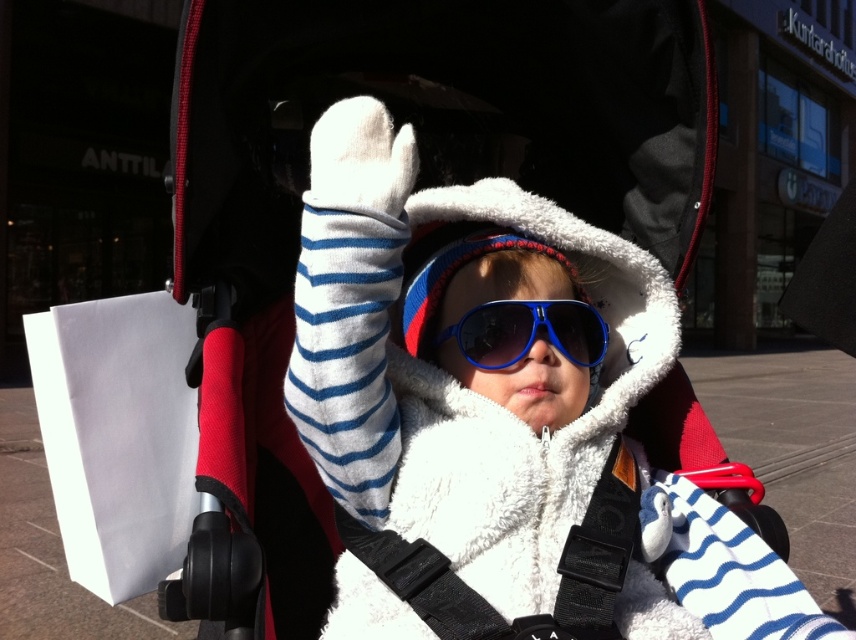
You are a parent trying to secure the white shopping bag to the stroller. The black fabric strap at center and the blue plastic goggles at center are both in your way. Which object should you move first to make more space?

The black fabric strap at center has a larger width than the blue plastic goggles at center, so you should move the black fabric strap at center first to create more space.

You are a parent trying to secure your child in the stroller. You have the black fabric strap at center and blue plastic goggles at center. Which item should you adjust first to ensure the goggles are properly secured?

The black fabric strap at center is positioned on the left side of blue plastic goggles at center, so you should adjust the black fabric strap at center first to ensure the goggles are properly secured.